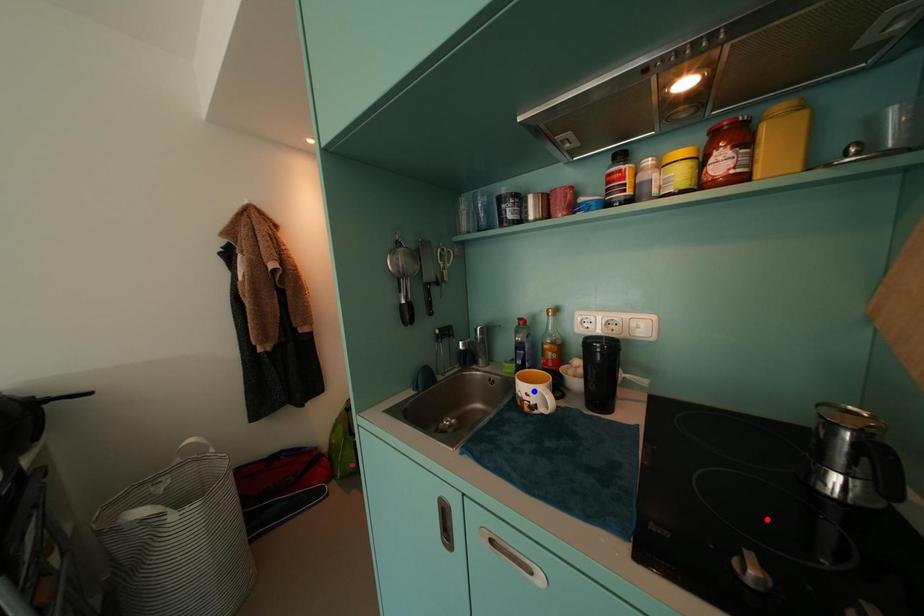
Question: In the image, two points are highlighted. Which point is nearer to the camera? Reply with the corresponding letter.

Choices:
 (A) blue point
 (B) red point

Answer: (B)